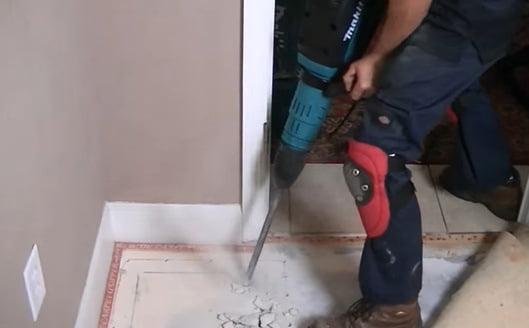
You are a GUI agent. You are given a task and a screenshot of the screen. Output one action in this format:
    pyautogui.click(x=<x>, y=<y>)
    Task: Click on the outlet
    The height and width of the screenshot is (328, 529).
    Given the screenshot: What is the action you would take?
    pyautogui.click(x=35, y=288)